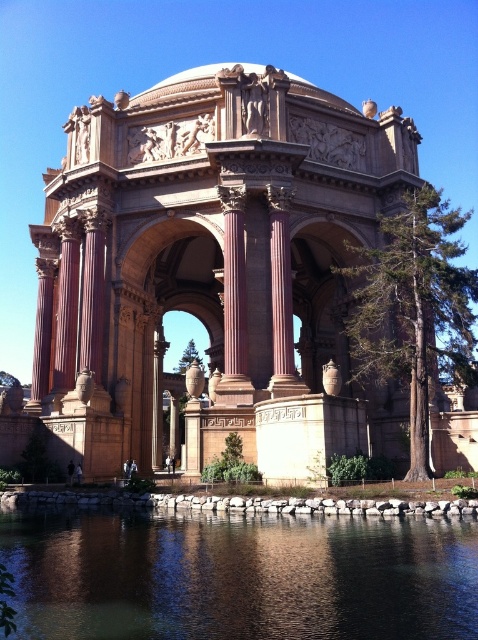
You are a tourist standing in front of the beige stone palace at center and want to take a photo of it. However, there is transparent water at lower center in front of you. Will the water block your view of the palace?

The beige stone palace at center is positioned over transparent water at lower center, so the water will not block your view of the palace as it is transparent.

You are standing in front of the Palace of Fine Arts and want to take a photo that includes both the beige stone palace at center and the transparent water at lower center. Based on their relative heights, which object should you position closer to the bottom of your camera frame?

The beige stone palace at center is taller than the transparent water at lower center, so you should position the transparent water at lower center closer to the bottom of your camera frame to include both in the photo.